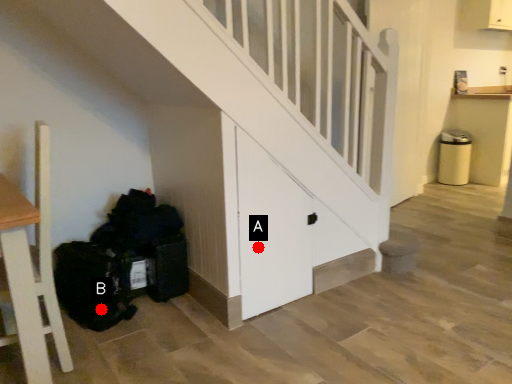
Question: Two points are circled on the image, labeled by A and B beside each circle. Which of the following is the closest to the observer?

Choices:
 (A) A is closer
 (B) B is closer

Answer: (A)